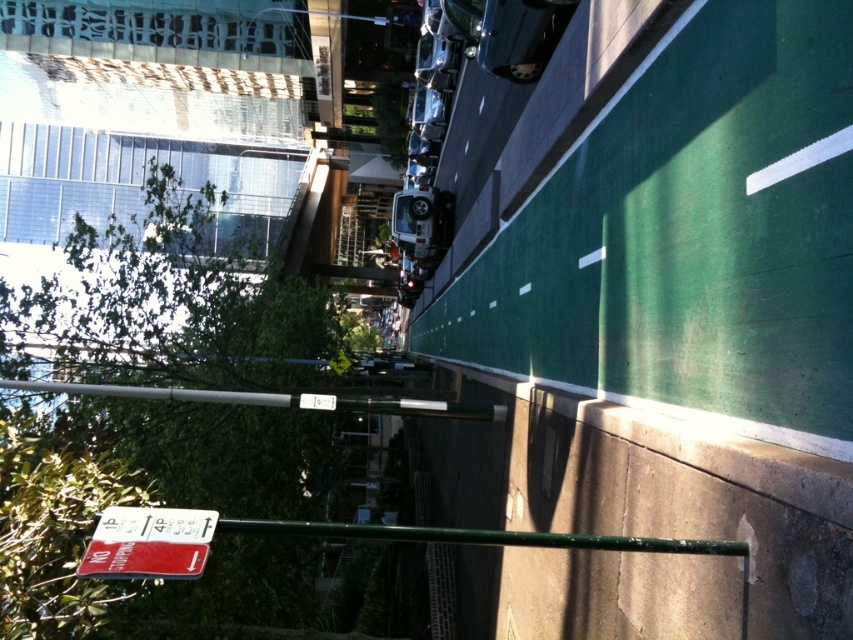
You are a pedestrian standing on the sidewalk looking towards the street. You see a silver metallic pole at center and a metallic silver train at center. Which object is closer to the ground?

The silver metallic pole at center is closer to the ground because it is positioned below the metallic silver train at center.

You are a delivery driver who needs to park your van near the silver metallic pole at center. Your van requires a parking space that is at least 8 meters away from any traffic signs to avoid a fine. Can you safely park your van here?

The distance of silver metallic pole at center from camera is 7.74 meters, which is less than the required 8 meters. Therefore, parking here would result in a fine.